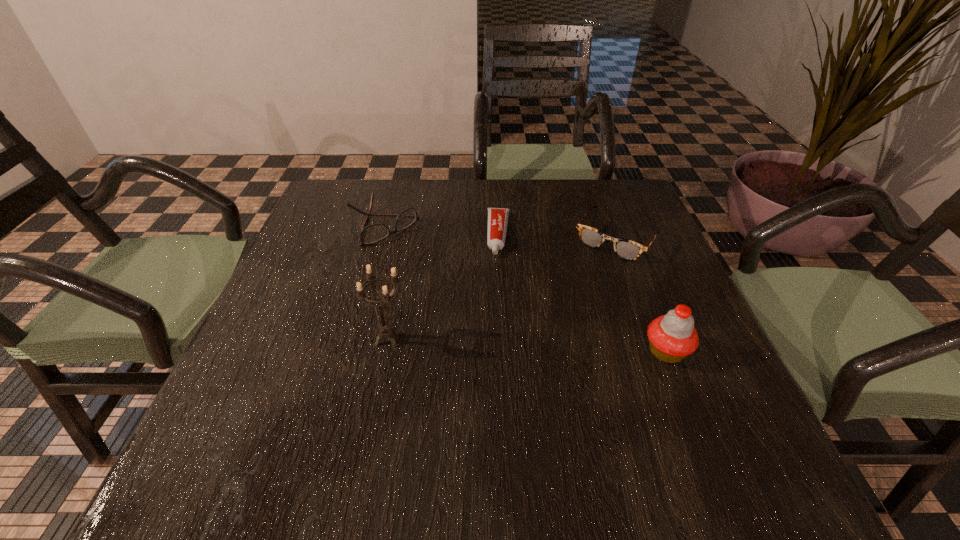
This screenshot has width=960, height=540. Find the location of `empty location between the right spectacles and the cupcake`. empty location between the right spectacles and the cupcake is located at coordinates click(641, 295).

Locate an element on the screen. The image size is (960, 540). empty space between the fourth shortest object and the shortest object is located at coordinates (583, 293).

Identify the location of empty location between the cupcake and the candle holder. (527, 345).

The image size is (960, 540). Identify the location of vacant area that lies between the toothpaste and the left spectacles. (442, 231).

In order to click on free space between the left spectacles and the third object from left to right in this screenshot , I will do `click(442, 231)`.

Identify the location of empty space that is in between the cupcake and the right spectacles. (641, 295).

Image resolution: width=960 pixels, height=540 pixels. I want to click on free space between the second tallest object and the right spectacles, so click(641, 295).

Identify which object is the fourth nearest to the left spectacles. Please provide its 2D coordinates. Your answer should be formatted as a tuple, i.e. [(x, y)], where the tuple contains the x and y coordinates of a point satisfying the conditions above.

[(672, 337)]

Identify which object is located as the third nearest to the candle holder. Please provide its 2D coordinates. Your answer should be formatted as a tuple, i.e. [(x, y)], where the tuple contains the x and y coordinates of a point satisfying the conditions above.

[(625, 249)]

You are a GUI agent. You are given a task and a screenshot of the screen. Output one action in this format:
    pyautogui.click(x=<x>, y=<y>)
    Task: Click on the vacant area that satisfies the following two spatial constraints: 1. on the front side of the right spectacles; 2. on the right side of the left spectacles
    The width and height of the screenshot is (960, 540).
    Given the screenshot: What is the action you would take?
    pyautogui.click(x=380, y=238)